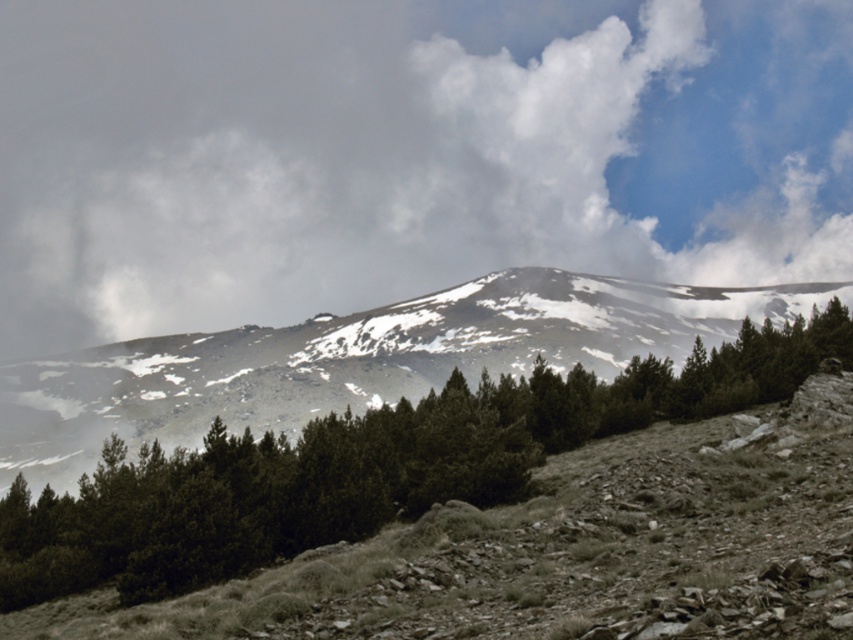
You are a hiker planning to take a photo of the green matte tree at center and the white fluffy cloud at upper center. Which one of these two objects appears wider in the image?

The white fluffy cloud at upper center appears wider than the green matte tree at center because its width surpasses the tree.

In the scene shown: You are an outdoor photographer planning to capture the mountain peak in your shot. You notice the white fluffy cloud at upper center and the green matte tree at center. Which object is positioned higher in the image?

The white fluffy cloud at upper center is located above the green matte tree at center, so it is positioned higher in the image.